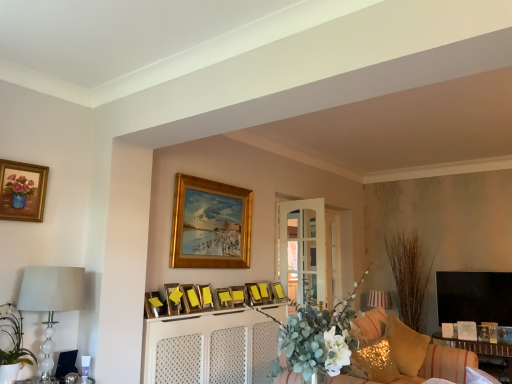
Question: Is wooden picture frame at center, the fourth picture frame in the right-to-left sequence, next to wooden picture frame at center, the 2th picture frame viewed from the right?

Choices:
 (A) no
 (B) yes

Answer: (A)

Question: Does wooden picture frame at center, marked as the 8th picture frame in a left-to-right arrangement, come in front of wooden picture frame at center, the 2th picture frame viewed from the right?

Choices:
 (A) yes
 (B) no

Answer: (A)

Question: Is wooden picture frame at center, marked as the 8th picture frame in a left-to-right arrangement, turned away from wooden picture frame at center, arranged as the tenth picture frame when viewed from the left?

Choices:
 (A) yes
 (B) no

Answer: (B)

Question: Could wooden picture frame at center, arranged as the tenth picture frame when viewed from the left, be considered to be inside wooden picture frame at center, marked as the 8th picture frame in a left-to-right arrangement?

Choices:
 (A) yes
 (B) no

Answer: (B)

Question: Can you confirm if wooden picture frame at center, marked as the 8th picture frame in a left-to-right arrangement, is positioned to the right of wooden picture frame at center, the 2th picture frame viewed from the right?

Choices:
 (A) no
 (B) yes

Answer: (A)

Question: From the image's perspective, is white glass lamp at left, the 1th lamp positioned from the left, above or below wooden picture frame at center, the eighth picture frame when ordered from right to left?

Choices:
 (A) above
 (B) below

Answer: (A)

Question: From a real-world perspective, relative to wooden picture frame at center, the eighth picture frame when ordered from right to left, is white glass lamp at left, which appears as the second lamp when viewed from the right, vertically above or below?

Choices:
 (A) below
 (B) above

Answer: (A)

Question: Considering the relative positions of white glass lamp at left, which appears as the second lamp when viewed from the right, and wooden picture frame at center, the eighth picture frame when ordered from right to left, in the image provided, is white glass lamp at left, which appears as the second lamp when viewed from the right, to the left or to the right of wooden picture frame at center, the eighth picture frame when ordered from right to left,?

Choices:
 (A) right
 (B) left

Answer: (B)

Question: Is white glass lamp at left, acting as the 1th lamp starting from the top, inside or outside of wooden picture frame at center, the 4th picture frame from the left?

Choices:
 (A) inside
 (B) outside

Answer: (B)

Question: Is point (247, 372) closer or farther from the camera than point (237, 296)?

Choices:
 (A) farther
 (B) closer

Answer: (B)

Question: Relative to wooden picture frame at center, marked as the 8th picture frame in a left-to-right arrangement, is white textured cabinet at center in front or behind?

Choices:
 (A) behind
 (B) front

Answer: (B)

Question: In terms of height, does white textured cabinet at center look taller or shorter compared to wooden picture frame at center, the fourth picture frame in the right-to-left sequence?

Choices:
 (A) tall
 (B) short

Answer: (A)

Question: Looking at their shapes, would you say white textured cabinet at center is wider or thinner than wooden picture frame at center, marked as the 8th picture frame in a left-to-right arrangement?

Choices:
 (A) thin
 (B) wide

Answer: (B)

Question: In terms of size, does matte gold picture frame at upper left, the 1th picture frame viewed from the left, appear bigger or smaller than white textured cabinet at center?

Choices:
 (A) big
 (B) small

Answer: (B)

Question: From their relative heights in the image, would you say matte gold picture frame at upper left, the 1th picture frame viewed from the left, is taller or shorter than white textured cabinet at center?

Choices:
 (A) short
 (B) tall

Answer: (A)